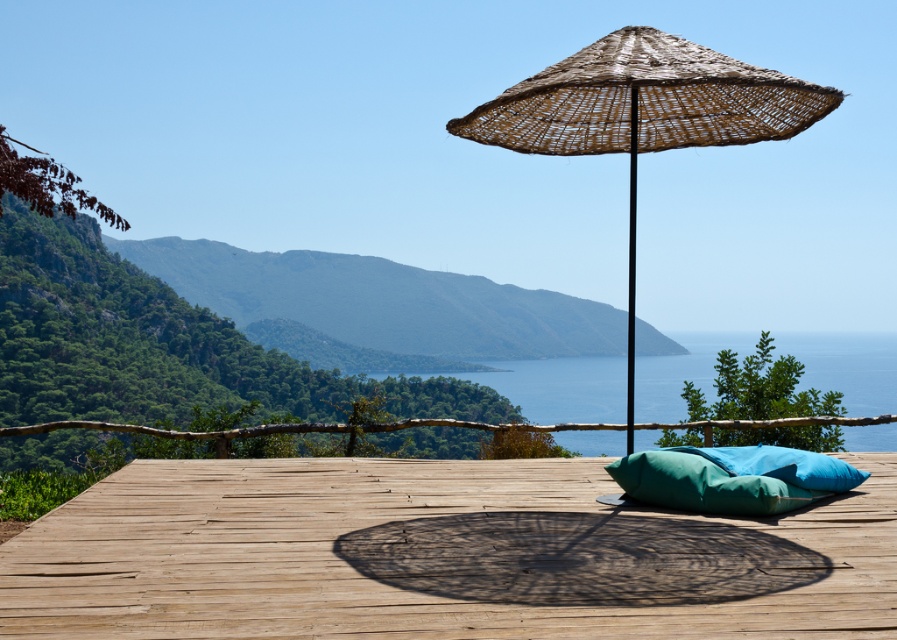
Question: Which point is closer to the camera?

Choices:
 (A) (634, 93)
 (B) (877, 586)
 (C) (692, 451)
 (D) (483, 125)

Answer: (B)

Question: Can you confirm if woven straw umbrella at center is positioned to the right of teal fabric pillow at center?

Choices:
 (A) yes
 (B) no

Answer: (B)

Question: Is woven straw umbrella at center below woven bamboo pole at center?

Choices:
 (A) no
 (B) yes

Answer: (A)

Question: Among these points, which one is nearest to the camera?

Choices:
 (A) (669, 67)
 (B) (525, 323)
 (C) (660, 621)

Answer: (C)

Question: Can you confirm if green leafy mountain at center is positioned to the right of teal fabric cushion at center?

Choices:
 (A) no
 (B) yes

Answer: (B)

Question: Which object is farther from the camera taking this photo?

Choices:
 (A) teal fabric cushion at center
 (B) teal fabric pillow at center
 (C) green leafy mountain at center
 (D) wooden deck at center

Answer: (C)